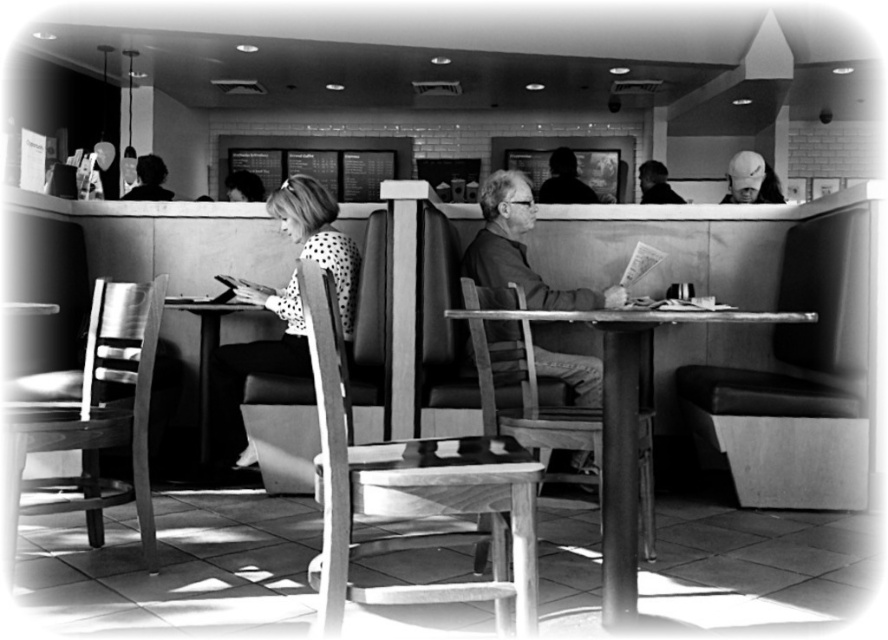
In the black and white photo of the dining area, there is a woman at a table with a chair facing her and a smooth brown shirt at center located at point (x=518, y=252). Which object is closer to the viewer, the woman at the table with a chair facing her or the smooth brown shirt at center?

The smooth brown shirt at center is located at point (x=518, y=252), which is closer to the viewer than the woman at the table with a chair facing her.

You are a photographer trying to capture the smooth brown shirt at center and the wooden table at lower left in a single shot. Based on their positions, can you determine which object is closer to the camera?

The smooth brown shirt at center is located above the wooden table at lower left, meaning it is closer to the camera than the wooden table at lower left.

You are a photographer trying to capture a candid shot of the smooth brown shirt at center and the wooden table at lower left. Since you want to ensure both subjects are in focus, you need to know which one is wider. Which object is wider?

The smooth brown shirt at center is wider than the wooden table at lower left according to the description.